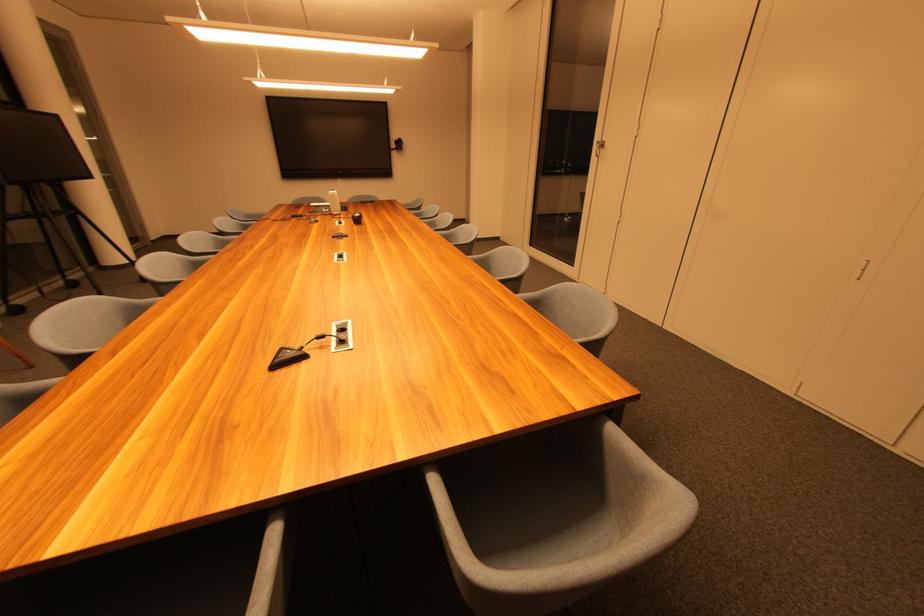
What do you see at coordinates (861, 270) in the screenshot? The width and height of the screenshot is (924, 616). I see `a white cabinet handle` at bounding box center [861, 270].